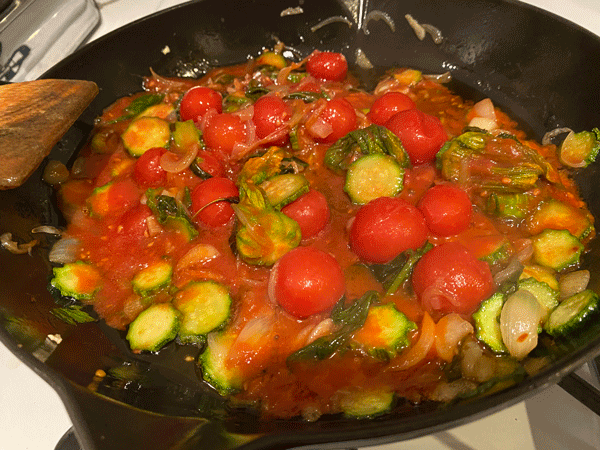
Point out all instances of where i would add spices and other vegetables. in the image. Your answer should be formatted as a list of tuples, i.e. [(x1, y1), (x2, y2), ...], where each tuple contains the x and y coordinates of a point satisfying the conditions above.

[(337, 240)]